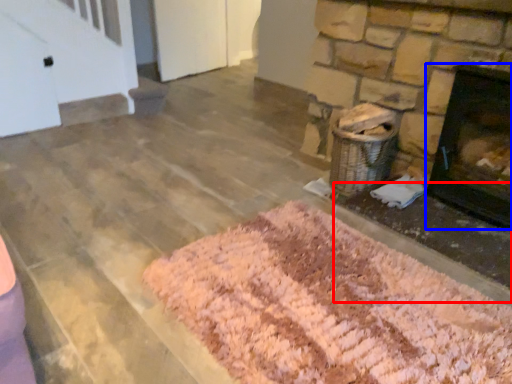
Question: Which of the following is the closest to the observer, foundation (highlighted by a red box) or fireplace (highlighted by a blue box)?

Choices:
 (A) foundation
 (B) fireplace

Answer: (A)